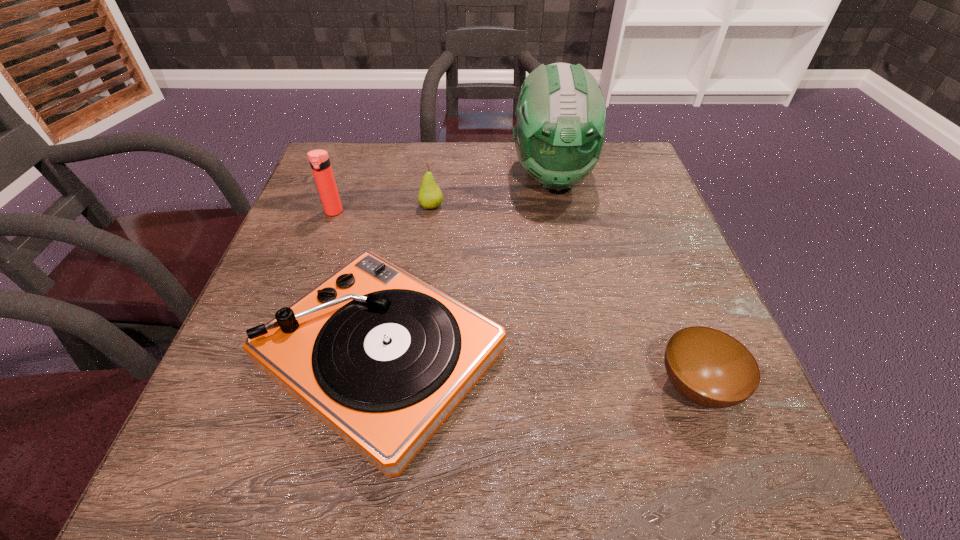
Locate an element on the screen. The width and height of the screenshot is (960, 540). blank region between the shortest object and the pear is located at coordinates (564, 297).

Where is `vacant point located between the bowl and the football helmet`? vacant point located between the bowl and the football helmet is located at coordinates (624, 282).

I want to click on free spot between the pear and the tallest object, so click(x=492, y=191).

Where is `free area in between the football helmet and the thermos bottle`? The image size is (960, 540). free area in between the football helmet and the thermos bottle is located at coordinates (443, 194).

Identify the location of object that can be found as the fourth closest to the third tallest object. The width and height of the screenshot is (960, 540). tap(708, 367).

Image resolution: width=960 pixels, height=540 pixels. Find the location of `object that stands as the third closest to the record player`. object that stands as the third closest to the record player is located at coordinates pyautogui.click(x=559, y=135).

In order to click on vacant space that satisfies the following two spatial constraints: 1. on the back side of the second shortest object; 2. on the right side of the pear in this screenshot , I will do `click(409, 206)`.

At what (x,y) coordinates should I click in order to perform the action: click on free location that satisfies the following two spatial constraints: 1. on the front side of the shortest object; 2. on the left side of the second tallest object. Please return your answer as a coordinate pair (x, y). The height and width of the screenshot is (540, 960). Looking at the image, I should click on (269, 387).